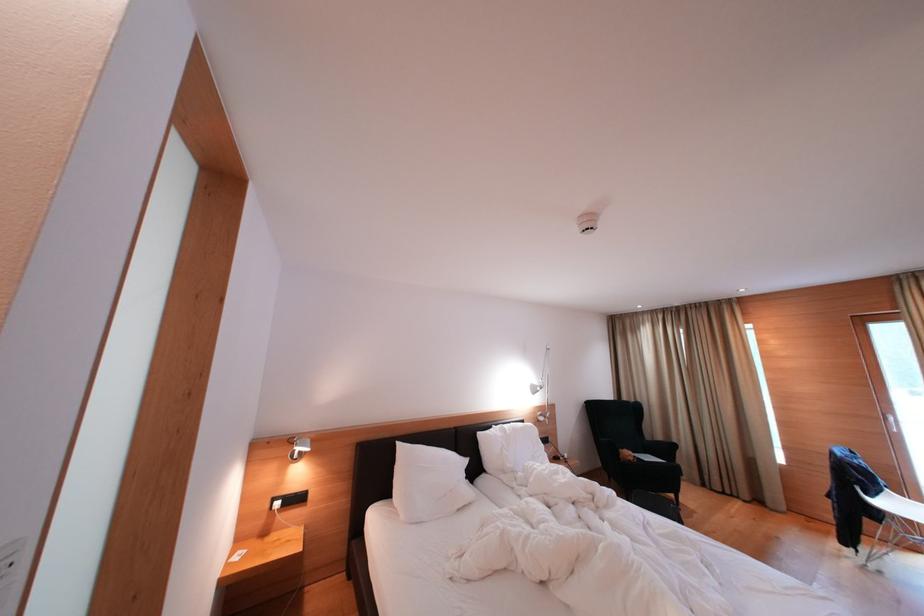
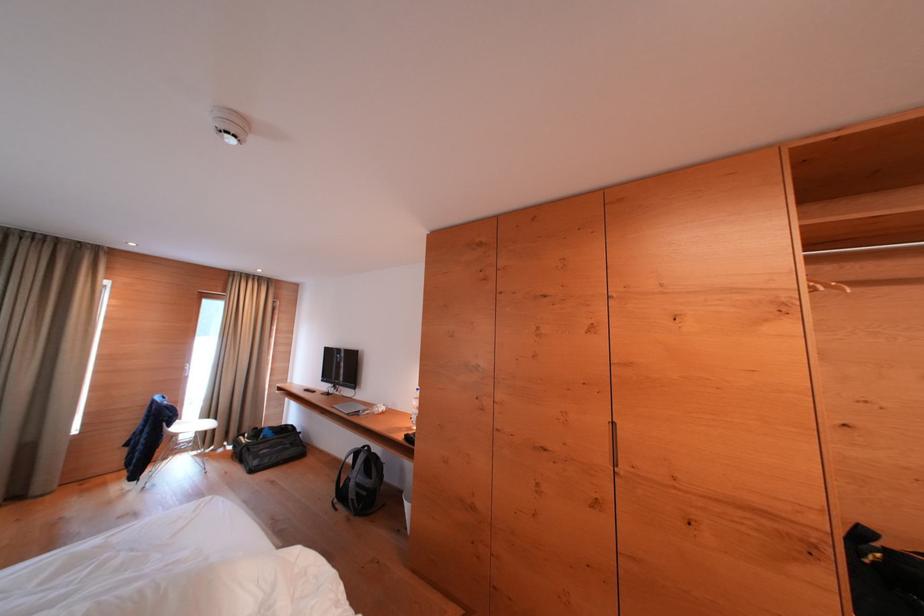
Question: The camera is either moving clockwise (left) or counter-clockwise (right) around the object. The first image is from the beginning of the video and the second image is from the end. Is the camera moving left or right when shooting the video?

Choices:
 (A) Left
 (B) Right

Answer: (A)